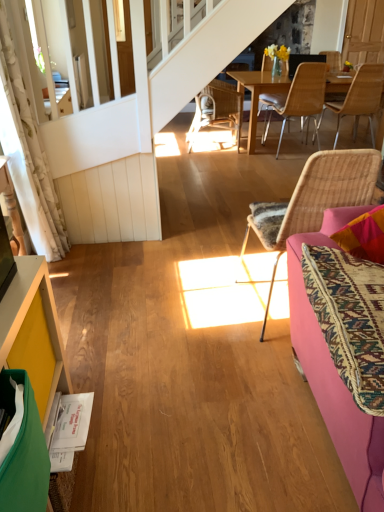
Measure the distance between point [362,180] and camera.

A distance of 1.63 meters exists between point [362,180] and camera.

This screenshot has width=384, height=512. What do you see at coordinates (217, 110) in the screenshot? I see `woven rattan chair at center, the fourth chair when ordered from front to back` at bounding box center [217, 110].

This screenshot has height=512, width=384. Describe the element at coordinates (359, 98) in the screenshot. I see `light brown wicker chair at upper right, which appears as the second chair when viewed from the back` at that location.

Measure the distance between pink fabric couch at right and camera.

A distance of 3.44 feet exists between pink fabric couch at right and camera.

Where is `woven wood chair at center, which appears as the 3th chair when viewed from the left`? The width and height of the screenshot is (384, 512). woven wood chair at center, which appears as the 3th chair when viewed from the left is located at coordinates (298, 99).

Which object is thinner, woven rattan chair at center, the first chair positioned from the front, or light brown wicker chair at upper right, which is the 3th chair from front to back?

woven rattan chair at center, the first chair positioned from the front, is thinner.

How many degrees apart are the facing directions of woven rattan chair at center, which is counted as the 2th chair, starting from the left, and light brown wicker chair at upper right, which appears as the first chair when viewed from the right?

The facing directions of woven rattan chair at center, which is counted as the 2th chair, starting from the left, and light brown wicker chair at upper right, which appears as the first chair when viewed from the right, are 4.62 degrees apart.

Based on their sizes in the image, would you say woven rattan chair at center, the 3th chair positioned from the right, is bigger or smaller than light brown wicker chair at upper right, which is the 3th chair from front to back?

Considering their sizes, woven rattan chair at center, the 3th chair positioned from the right, takes up less space than light brown wicker chair at upper right, which is the 3th chair from front to back.

How far apart are woven rattan chair at center, which is counted as the 2th chair, starting from the left, and light brown wicker chair at upper right, which appears as the first chair when viewed from the right?

9.54 feet.

From a real-world perspective, is woven rattan chair at center, acting as the fourth chair starting from the right, over light brown wicker chair at upper right, which appears as the second chair when viewed from the back?

No, from a real-world perspective, woven rattan chair at center, acting as the fourth chair starting from the right, is not over light brown wicker chair at upper right, which appears as the second chair when viewed from the back

Is woven rattan chair at center, acting as the fourth chair starting from the right, wider or thinner than light brown wicker chair at upper right, which appears as the second chair when viewed from the back?

woven rattan chair at center, acting as the fourth chair starting from the right, is thinner than light brown wicker chair at upper right, which appears as the second chair when viewed from the back.

Which of these two, woven rattan chair at center, the fourth chair when ordered from front to back, or light brown wicker chair at upper right, which ranks as the fourth chair in left-to-right order, stands shorter?

Standing shorter between the two is woven rattan chair at center, the fourth chair when ordered from front to back.

Can you confirm if woven rattan chair at center, the fourth chair when ordered from front to back, is smaller than light brown wicker chair at upper right, which is the 3th chair from front to back?

Actually, woven rattan chair at center, the fourth chair when ordered from front to back, might be larger than light brown wicker chair at upper right, which is the 3th chair from front to back.

Is woven rattan chair at center, arranged as the 4th chair when viewed from the back, next to yellow painted wood cabinet at lower left and touching it?

No, woven rattan chair at center, arranged as the 4th chair when viewed from the back, is not with yellow painted wood cabinet at lower left.

In the scene shown: Which object is positioned more to the left, woven rattan chair at center, the 3th chair positioned from the right, or yellow painted wood cabinet at lower left?

Positioned to the left is yellow painted wood cabinet at lower left.

From a real-world perspective, is woven rattan chair at center, arranged as the 4th chair when viewed from the back, on top of yellow painted wood cabinet at lower left?

Yes.

Is woven rattan chair at center, the first chair positioned from the front, positioned with its back to yellow painted wood cabinet at lower left?

No.

Looking at this image, considering the positions of objects yellow painted wood cabinet at lower left and light brown wicker chair at upper right, which ranks as the fourth chair in left-to-right order, in the image provided, who is more to the left, yellow painted wood cabinet at lower left or light brown wicker chair at upper right, which ranks as the fourth chair in left-to-right order,?

yellow painted wood cabinet at lower left is more to the left.

Is yellow painted wood cabinet at lower left placed right next to light brown wicker chair at upper right, which appears as the first chair when viewed from the right?

yellow painted wood cabinet at lower left and light brown wicker chair at upper right, which appears as the first chair when viewed from the right, are clearly separated.

From the image's perspective, is yellow painted wood cabinet at lower left under light brown wicker chair at upper right, which is the 3th chair from front to back?

Yes, from the image's perspective, yellow painted wood cabinet at lower left is beneath light brown wicker chair at upper right, which is the 3th chair from front to back.

Considering the relative sizes of light brown wicker chair at upper right, which ranks as the fourth chair in left-to-right order, and woven rattan chair at center, the 1th chair when ordered from back to front, in the image provided, is light brown wicker chair at upper right, which ranks as the fourth chair in left-to-right order, wider than woven rattan chair at center, the 1th chair when ordered from back to front,?

Yes, light brown wicker chair at upper right, which ranks as the fourth chair in left-to-right order, is wider than woven rattan chair at center, the 1th chair when ordered from back to front.

From the image's perspective, is light brown wicker chair at upper right, which ranks as the fourth chair in left-to-right order, positioned above or below woven rattan chair at center, acting as the fourth chair starting from the right?

Based on their image positions, light brown wicker chair at upper right, which ranks as the fourth chair in left-to-right order, is located beneath woven rattan chair at center, acting as the fourth chair starting from the right.

Based on the photo, how different are the orientations of light brown wicker chair at upper right, which ranks as the fourth chair in left-to-right order, and woven rattan chair at center, the fourth chair when ordered from front to back, in degrees?

light brown wicker chair at upper right, which ranks as the fourth chair in left-to-right order, and woven rattan chair at center, the fourth chair when ordered from front to back, are facing 90 degrees away from each other.

Is the depth of light brown wicker chair at upper right, which appears as the first chair when viewed from the right, less than that of woven rattan chair at center, the fourth chair when ordered from front to back?

Yes, it is in front of woven rattan chair at center, the fourth chair when ordered from front to back.

Locate an element on the screen. chair below the white floral fabric curtain at left (from the image's perspective) is located at coordinates (313, 200).

Is woven rattan chair at center, arranged as the 4th chair when viewed from the back, to the right of white floral fabric curtain at left from the viewer's perspective?

Indeed, woven rattan chair at center, arranged as the 4th chair when viewed from the back, is positioned on the right side of white floral fabric curtain at left.

Is woven rattan chair at center, which is counted as the 2th chair, starting from the left, looking in the opposite direction of white floral fabric curtain at left?

woven rattan chair at center, which is counted as the 2th chair, starting from the left, does not have its back to white floral fabric curtain at left.

Between woven rattan chair at center, the 3th chair positioned from the right, and white floral fabric curtain at left, which one has larger width?

woven rattan chair at center, the 3th chair positioned from the right, is wider.

Is light brown wicker chair at upper right, which appears as the second chair when viewed from the back, located outside pink fabric couch at right?

light brown wicker chair at upper right, which appears as the second chair when viewed from the back, is positioned outside pink fabric couch at right.

Which of these two, light brown wicker chair at upper right, which ranks as the fourth chair in left-to-right order, or pink fabric couch at right, is wider?

With larger width is light brown wicker chair at upper right, which ranks as the fourth chair in left-to-right order.

Consider the image. Does light brown wicker chair at upper right, which ranks as the fourth chair in left-to-right order, appear on the right side of pink fabric couch at right?

Yes.

The height and width of the screenshot is (512, 384). I want to click on the 2nd chair above when counting from the woven rattan chair at center, the first chair positioned from the front (from the image's perspective), so click(359, 98).

Identify the location of the 3rd chair to the left of the light brown wicker chair at upper right, which is the 3th chair from front to back, counting from the anchor's position. The width and height of the screenshot is (384, 512). (217, 110).

Which object lies nearer to the anchor point white floral fabric curtain at left, woven wood chair at center, the third chair viewed from the back, or light brown wicker chair at upper right, which appears as the second chair when viewed from the back?

Among the two, woven wood chair at center, the third chair viewed from the back, is located nearer to white floral fabric curtain at left.

Estimate the real-world distances between objects in this image. Which object is further from woven rattan chair at center, the fourth chair when ordered from front to back, white floral fabric curtain at left or pink fabric couch at right?

pink fabric couch at right lies further to woven rattan chair at center, the fourth chair when ordered from front to back, than the other object.

When comparing their distances from woven rattan chair at center, which is counted as the 2th chair, starting from the left, does woven rattan chair at center, acting as the fourth chair starting from the right, or woven wood chair at center, positioned as the second chair in front-to-back order, seem further?

woven rattan chair at center, acting as the fourth chair starting from the right.

When comparing their distances from yellow painted wood cabinet at lower left, does pink fabric couch at right or woven wood chair at center, positioned as the second chair in front-to-back order, seem further?

Among the two, woven wood chair at center, positioned as the second chair in front-to-back order, is located further to yellow painted wood cabinet at lower left.

Which object lies nearer to the anchor point white floral fabric curtain at left, yellow painted wood cabinet at lower left or woven rattan chair at center, arranged as the 4th chair when viewed from the back?

Among the two, yellow painted wood cabinet at lower left is located nearer to white floral fabric curtain at left.

Considering their positions, is yellow painted wood cabinet at lower left positioned closer to light brown wicker chair at upper right, which appears as the second chair when viewed from the back, than woven wood chair at center, positioned as the second chair in front-to-back order?

woven wood chair at center, positioned as the second chair in front-to-back order, is closer to light brown wicker chair at upper right, which appears as the second chair when viewed from the back.

Consider the image. Which object lies nearer to the anchor point woven rattan chair at center, arranged as the 4th chair when viewed from the back, pink fabric couch at right or white floral fabric curtain at left?

Among the two, pink fabric couch at right is located nearer to woven rattan chair at center, arranged as the 4th chair when viewed from the back.

When comparing their distances from woven wood chair at center, positioned as the second chair in front-to-back order, does white floral fabric curtain at left or light brown wicker chair at upper right, which appears as the first chair when viewed from the right, seem closer?

Based on the image, light brown wicker chair at upper right, which appears as the first chair when viewed from the right, appears to be nearer to woven wood chair at center, positioned as the second chair in front-to-back order.

The height and width of the screenshot is (512, 384). What are the coordinates of `chair located between pink fabric couch at right and woven wood chair at center, the 2th chair from the right, in the depth direction` in the screenshot? It's located at (313, 200).

I want to click on cabinetry situated between white floral fabric curtain at left and pink fabric couch at right from left to right, so click(x=34, y=333).

At what (x,y) coordinates should I click in order to perform the action: click on curtain positioned between yellow painted wood cabinet at lower left and woven rattan chair at center, the fourth chair when ordered from front to back, from near to far. Please return your answer as a coordinate pair (x, y). Looking at the image, I should click on (31, 148).

Find the location of a particular element. The height and width of the screenshot is (512, 384). cabinetry between white floral fabric curtain at left and woven rattan chair at center, which is counted as the 2th chair, starting from the left, from left to right is located at coordinates (34, 333).